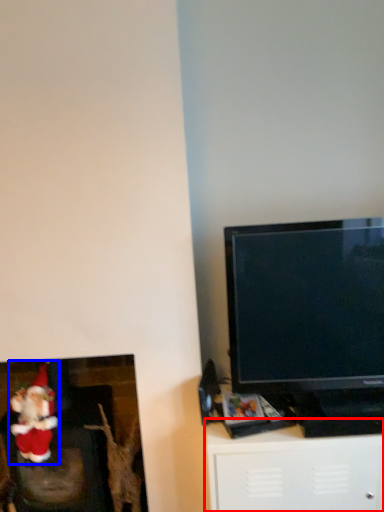
Question: Which object is further to the camera taking this photo, furniture (highlighted by a red box) or santa claus (highlighted by a blue box)?

Choices:
 (A) furniture
 (B) santa claus

Answer: (B)